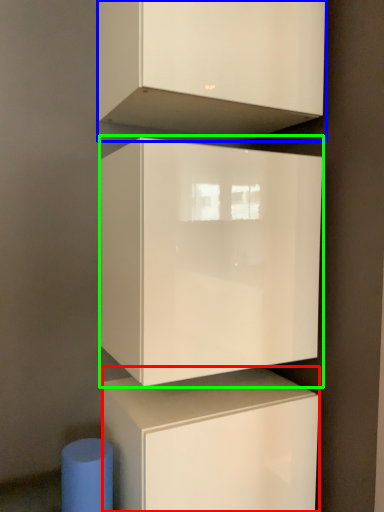
Question: Based on their relative distances, which object is nearer to cabinetry (highlighted by a red box)? Choose from cabinetry (highlighted by a blue box) and cabinetry (highlighted by a green box).

Choices:
 (A) cabinetry
 (B) cabinetry

Answer: (B)